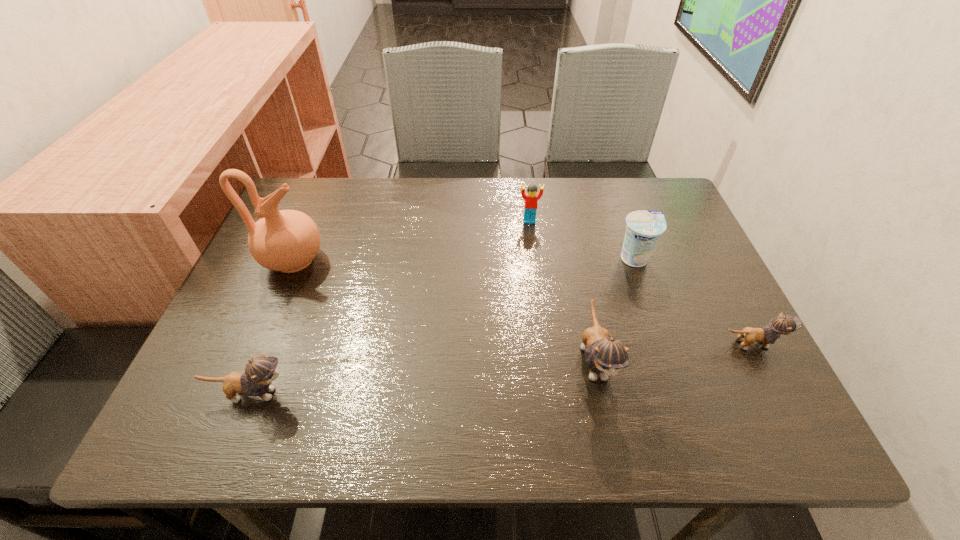
To achieve uniform spacing by inserting another kitten among them, please point to a free space for this new kitten. Please provide its 2D coordinates. Your answer should be formatted as a tuple, i.e. [(x, y)], where the tuple contains the x and y coordinates of a point satisfying the conditions above.

[(428, 377)]